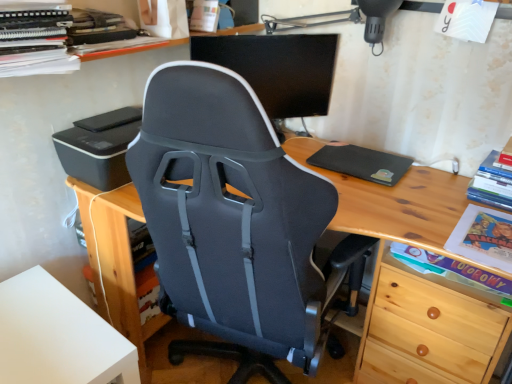
This screenshot has width=512, height=384. I want to click on free space underneath black matte/black rubberized mousepad at right (from a real-world perspective), so click(377, 171).